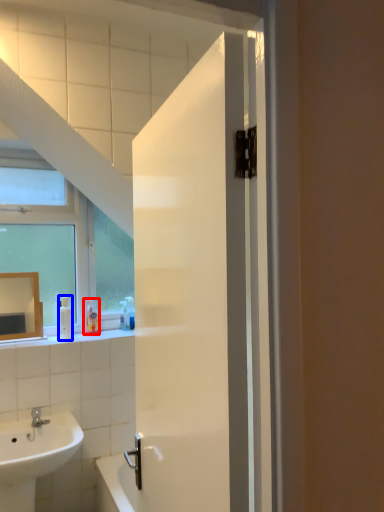
Question: Which object is closer to the camera taking this photo, toiletry (highlighted by a red box) or soap dispenser (highlighted by a blue box)?

Choices:
 (A) toiletry
 (B) soap dispenser

Answer: (B)